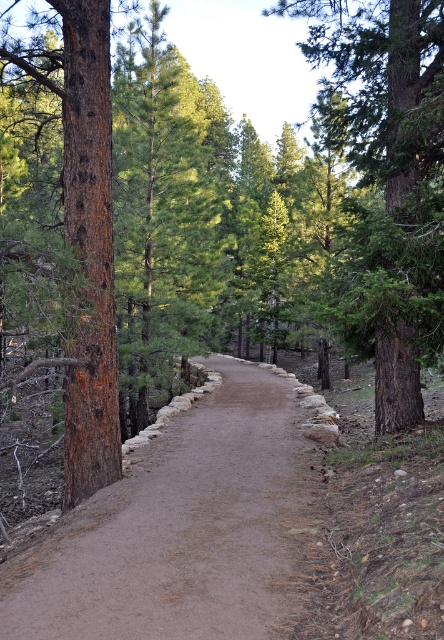
Question: Does dirt path at center have a larger size compared to green rough bark tree at center?

Choices:
 (A) yes
 (B) no

Answer: (B)

Question: Is dirt path at center above green rough bark tree at center?

Choices:
 (A) no
 (B) yes

Answer: (A)

Question: Is dirt path at center smaller than green rough bark tree at center?

Choices:
 (A) no
 (B) yes

Answer: (B)